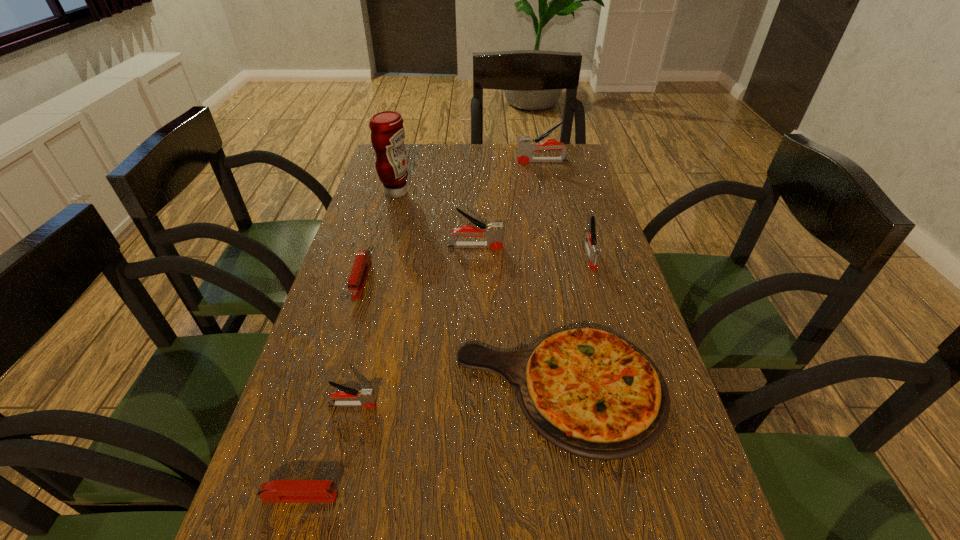
This screenshot has height=540, width=960. Find the location of `the second shortest stapler`. the second shortest stapler is located at coordinates (357, 280).

The height and width of the screenshot is (540, 960). I want to click on the farther red stapler, so click(357, 280).

Where is `pizza`? Image resolution: width=960 pixels, height=540 pixels. pizza is located at coordinates (593, 394).

This screenshot has height=540, width=960. I want to click on the nearest stapler, so click(x=276, y=491).

Locate an element on the screen. Image resolution: width=960 pixels, height=540 pixels. the smaller red stapler is located at coordinates (276, 491).

Find the location of a particular element. Image resolution: width=960 pixels, height=540 pixels. vacant space located on the right of the tallest object is located at coordinates (458, 192).

Identify the location of free space located 0.140m on the handle side of the tallest stapler. The image size is (960, 540). (478, 161).

Where is `free spot located on the handle side of the tallest stapler`? The image size is (960, 540). free spot located on the handle side of the tallest stapler is located at coordinates (425, 161).

Locate an element on the screen. free location located on the handle side of the tallest stapler is located at coordinates (459, 161).

At what (x,y) coordinates should I click in order to perform the action: click on free location located 0.240m on the handle side of the third tallest object. Please return your answer as a coordinate pair (x, y). This screenshot has width=960, height=540. Looking at the image, I should click on (589, 246).